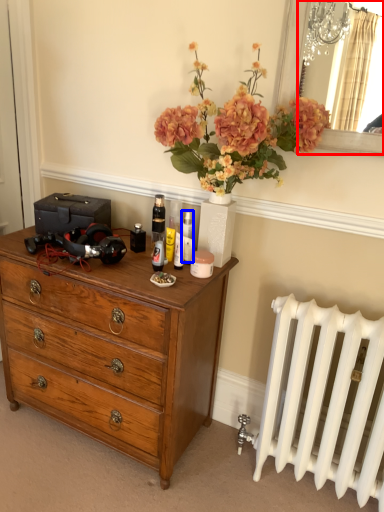
Question: Which object is further to the camera taking this photo, mirror (highlighted by a red box) or toiletry (highlighted by a blue box)?

Choices:
 (A) mirror
 (B) toiletry

Answer: (B)